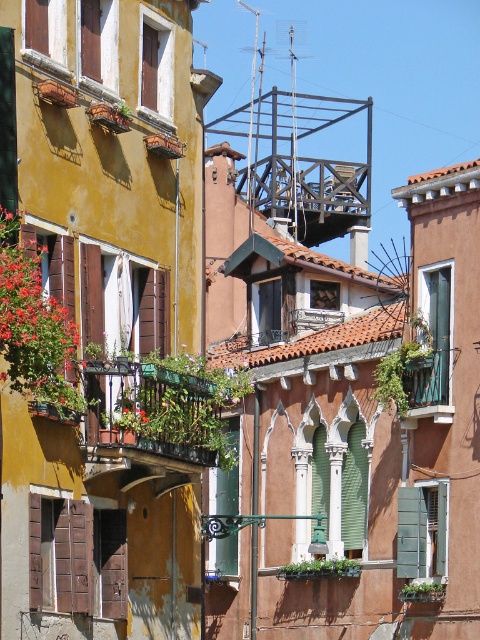
Can you confirm if green metal balcony at center is shorter than brown wooden shutter at lower left?

Yes.

The height and width of the screenshot is (640, 480). I want to click on green metal balcony at center, so click(x=155, y=412).

The image size is (480, 640). What are the coordinates of `green metal balcony at center` in the screenshot? It's located at (155, 412).